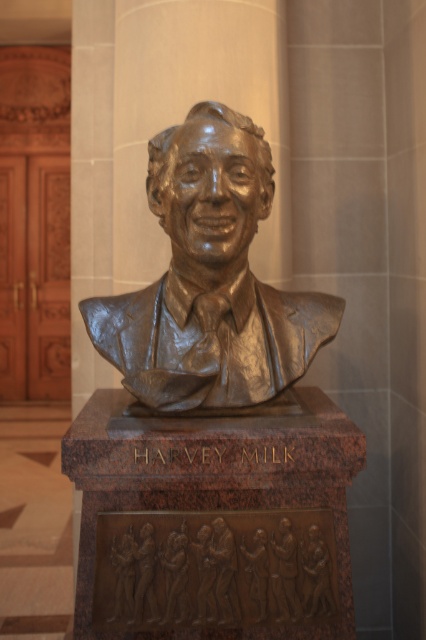
Which is below, shiny bronze bust at center or bronze relief figures at center?

bronze relief figures at center is lower down.

Measure the distance between point (267,371) and camera.

They are 1.93 meters apart.

Between point (282, 384) and point (141, 550), which one is positioned in front?

Point (141, 550)

This screenshot has height=640, width=426. I want to click on shiny bronze bust at center, so click(x=210, y=280).